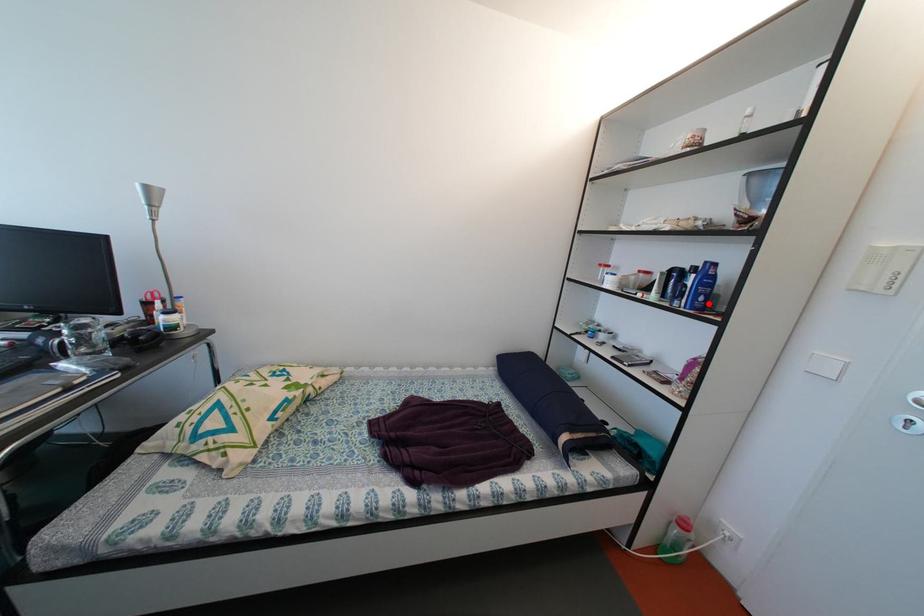
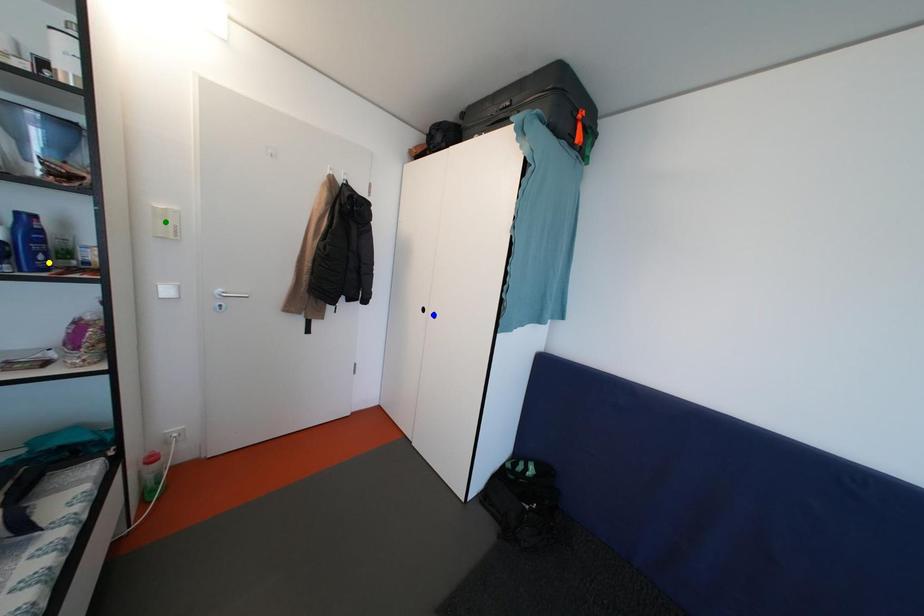
Question: I am providing you with two images of the same scene from different viewpoints. A red point is marked on the first image. You are given multiple points on the second image. Which point in image 2 is actually the same real-world point as the red point in image 1?

Choices:
 (A) blue point
 (B) yellow point
 (C) green point

Answer: (B)